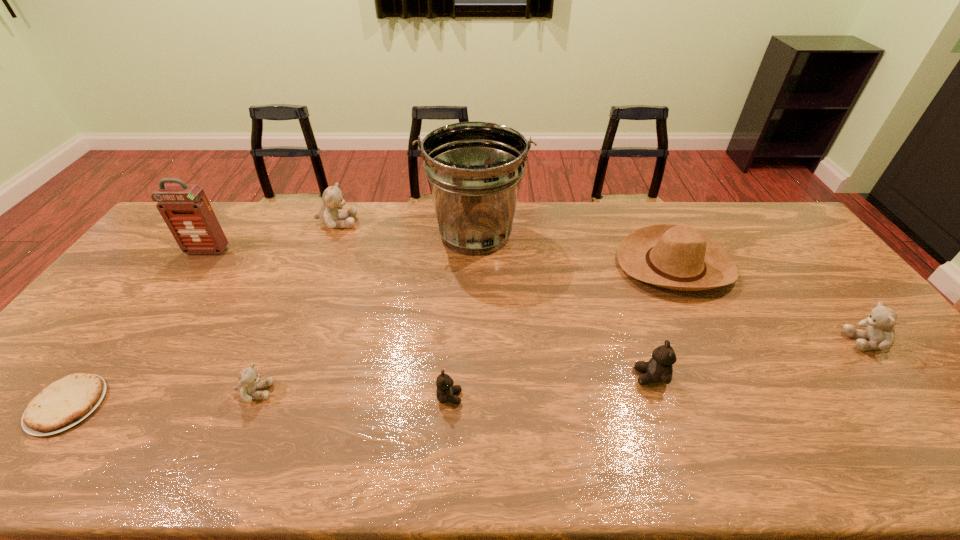
At what (x,y) coordinates should I click in order to perform the action: click on vacant space located 0.390m on the face of the right brown teddy bear. Please return your answer as a coordinate pair (x, y). Looking at the image, I should click on (480, 376).

You are a GUI agent. You are given a task and a screenshot of the screen. Output one action in this format:
    pyautogui.click(x=<x>, y=<y>)
    Task: Click on the free space located on the face of the right brown teddy bear
    The height and width of the screenshot is (540, 960).
    Given the screenshot: What is the action you would take?
    pyautogui.click(x=607, y=376)

Find the location of a particular element. The height and width of the screenshot is (540, 960). vacant area situated on the face of the rightmost object is located at coordinates (738, 341).

This screenshot has width=960, height=540. In order to click on vacant space located on the face of the rightmost object in this screenshot , I will do `click(808, 341)`.

This screenshot has width=960, height=540. I want to click on vacant space located on the face of the rightmost object, so click(x=757, y=341).

Locate an element on the screen. The width and height of the screenshot is (960, 540). free region located on the face of the third teddy bear from right to left is located at coordinates [x=528, y=397].

The image size is (960, 540). What are the coordinates of `vacant space situated on the face of the smallest gray teddy bear` in the screenshot? It's located at (331, 392).

The width and height of the screenshot is (960, 540). In order to click on vacant space located on the back of the shortest object in this screenshot , I will do `click(139, 312)`.

This screenshot has width=960, height=540. In order to click on bucket that is at the far edge in this screenshot , I will do `click(474, 169)`.

Find the location of `teddy bear that is at the far edge`. teddy bear that is at the far edge is located at coordinates (329, 215).